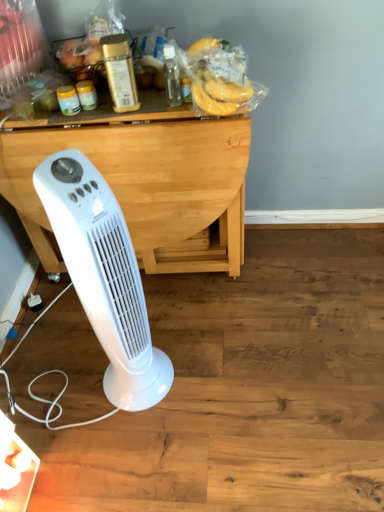
Question: Is wooden table at center smaller than yellow matte bananas at upper center?

Choices:
 (A) yes
 (B) no

Answer: (B)

Question: Could you tell me if wooden table at center is turned towards yellow matte bananas at upper center?

Choices:
 (A) no
 (B) yes

Answer: (A)

Question: Are wooden table at center and yellow matte bananas at upper center making contact?

Choices:
 (A) yes
 (B) no

Answer: (B)

Question: From the image's perspective, does wooden table at center appear higher than yellow matte bananas at upper center?

Choices:
 (A) no
 (B) yes

Answer: (A)

Question: From a real-world perspective, is wooden table at center positioned over yellow matte bananas at upper center based on gravity?

Choices:
 (A) no
 (B) yes

Answer: (A)

Question: Would you say yellow matte bananas at upper center is inside or outside gold metallic container at upper center, the first bottle positioned from the left?

Choices:
 (A) outside
 (B) inside

Answer: (A)

Question: Is point (231, 86) positioned closer to the camera than point (135, 101)?

Choices:
 (A) closer
 (B) farther

Answer: (A)

Question: Based on their sizes in the image, would you say yellow matte bananas at upper center is bigger or smaller than gold metallic container at upper center, the first bottle positioned from the left?

Choices:
 (A) big
 (B) small

Answer: (A)

Question: Considering their positions, is yellow matte bananas at upper center located in front of or behind gold metallic container at upper center, the second bottle viewed from the right?

Choices:
 (A) behind
 (B) front

Answer: (A)

Question: Is yellow matte bananas at upper center bigger or smaller than white plastic tower fan at lower left?

Choices:
 (A) big
 (B) small

Answer: (B)

Question: From the image's perspective, is yellow matte bananas at upper center positioned above or below white plastic tower fan at lower left?

Choices:
 (A) below
 (B) above

Answer: (B)

Question: Considering the relative positions of yellow matte bananas at upper center and white plastic tower fan at lower left in the image provided, is yellow matte bananas at upper center to the left or to the right of white plastic tower fan at lower left?

Choices:
 (A) right
 (B) left

Answer: (A)

Question: Does point (213, 105) appear closer or farther from the camera than point (100, 317)?

Choices:
 (A) farther
 (B) closer

Answer: (A)

Question: From their relative heights in the image, would you say gold metallic container at upper center, the second bottle viewed from the right, is taller or shorter than yellow matte bananas at upper center?

Choices:
 (A) short
 (B) tall

Answer: (B)

Question: Would you say gold metallic container at upper center, the second bottle viewed from the right, is to the left or to the right of yellow matte bananas at upper center in the picture?

Choices:
 (A) right
 (B) left

Answer: (B)